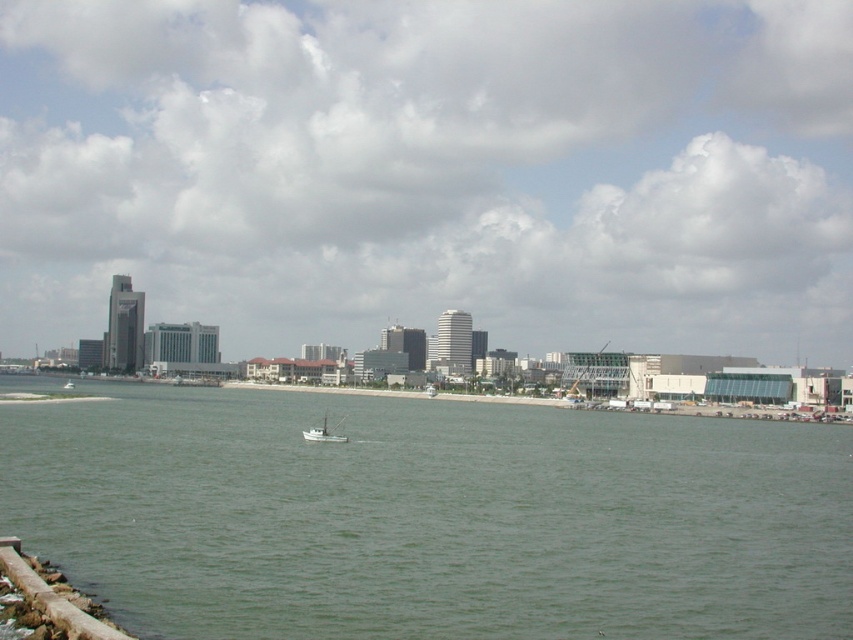
Question: Which point appears farthest from the camera in this image?

Choices:
 (A) (335, 436)
 (B) (10, 205)

Answer: (B)

Question: Does transparent glass skyscrapers at center have a lesser width compared to green water at lower left?

Choices:
 (A) yes
 (B) no

Answer: (B)

Question: Is transparent glass skyscrapers at center thinner than green water at lower left?

Choices:
 (A) yes
 (B) no

Answer: (B)

Question: Which of the following is the farthest from the observer?

Choices:
 (A) green water at lower left
 (B) transparent glass skyscrapers at center
 (C) white matte boat at center

Answer: (B)

Question: Which object is positioned closest to the white matte boat at center?

Choices:
 (A) green water at lower left
 (B) transparent glass skyscrapers at center

Answer: (A)

Question: Can you confirm if transparent glass skyscrapers at center is smaller than green water at lower left?

Choices:
 (A) no
 (B) yes

Answer: (A)